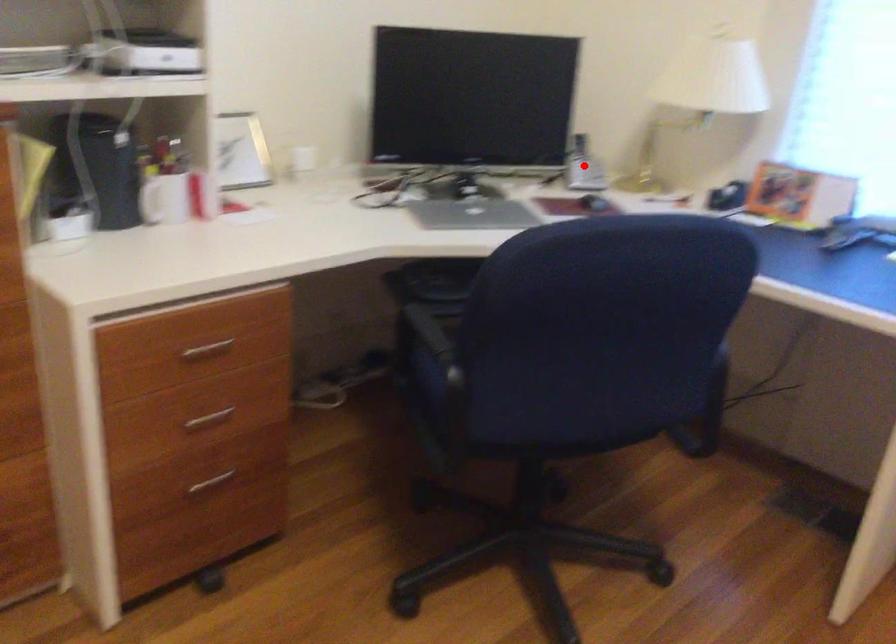
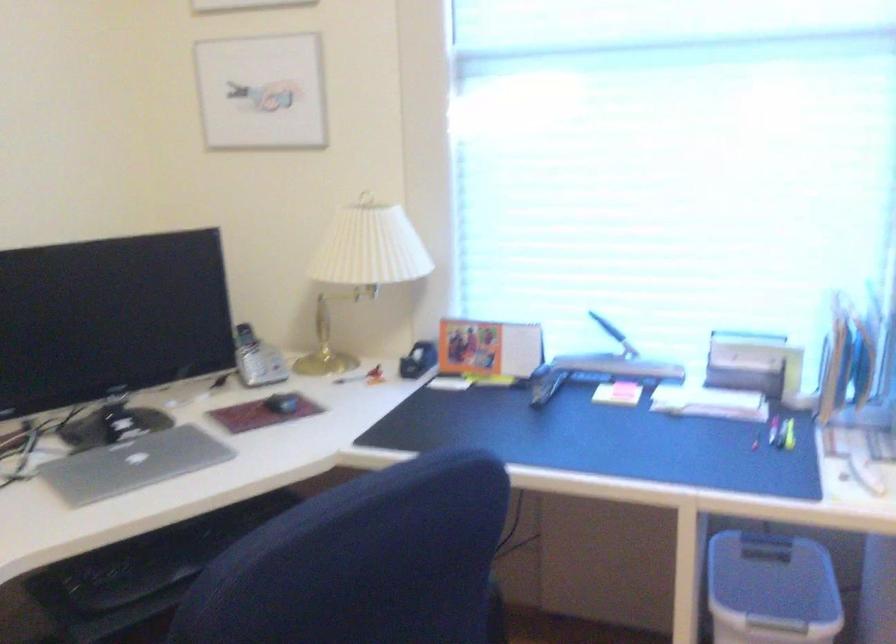
The point at the highlighted location is marked in the first image. Where is the corresponding point in the second image?

(256, 359)